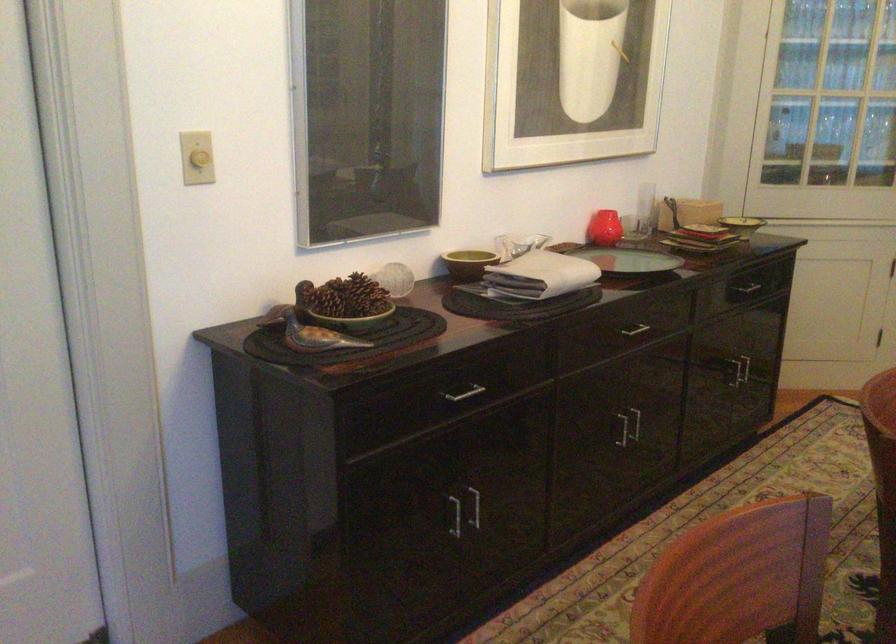
Find the location of a particular element. dimmer switch knob is located at coordinates (200, 158).